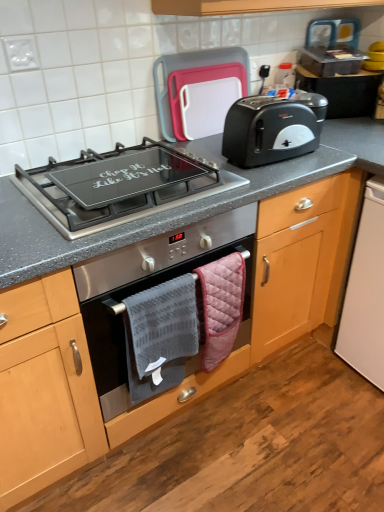
Identify the location of plastic cutting board at upper center. (199, 91).

The height and width of the screenshot is (512, 384). What are the coordinates of `pink quilted hand towel at lower center, the 1th hand towel viewed from the right` in the screenshot? It's located at (220, 306).

This screenshot has height=512, width=384. What do you see at coordinates (220, 306) in the screenshot?
I see `pink quilted hand towel at lower center, the 2th hand towel from the left` at bounding box center [220, 306].

Describe the element at coordinates (119, 186) in the screenshot. I see `black glass cooktop at center` at that location.

What is the approximate height of black glass cooktop at center?

black glass cooktop at center is 1.68 inches tall.

Image resolution: width=384 pixels, height=512 pixels. Identify the location of stainless steel oven at center. (146, 288).

Image resolution: width=384 pixels, height=512 pixels. I want to click on plastic cutting board at upper center, so click(x=199, y=91).

Does metallic silver toaster at upper right, the 1th appliance in the top-to-bottom sequence, come behind gray textured towel at center, which appears as the first hand towel when viewed from the left?

That is True.

Can you confirm if metallic silver toaster at upper right, which ranks as the second appliance in bottom-to-top order, is positioned to the right of gray textured towel at center, which appears as the first hand towel when viewed from the left?

Indeed, metallic silver toaster at upper right, which ranks as the second appliance in bottom-to-top order, is positioned on the right side of gray textured towel at center, which appears as the first hand towel when viewed from the left.

Considering the relative sizes of metallic silver toaster at upper right, the 1th appliance in the top-to-bottom sequence, and gray textured towel at center, which appears as the first hand towel when viewed from the left, in the image provided, is metallic silver toaster at upper right, the 1th appliance in the top-to-bottom sequence, taller than gray textured towel at center, which appears as the first hand towel when viewed from the left,?

No.

From a real-world perspective, is metallic silver toaster at upper right, which ranks as the second appliance in bottom-to-top order, positioned over gray textured towel at center, which appears as the first hand towel when viewed from the left, based on gravity?

Indeed, from a real-world perspective, metallic silver toaster at upper right, which ranks as the second appliance in bottom-to-top order, stands above gray textured towel at center, which appears as the first hand towel when viewed from the left.

From a real-world perspective, is white plastic dishwasher at lower right, marked as the first appliance in a bottom-to-top arrangement, positioned above or below black plastic toaster at upper right?

From a real-world perspective, white plastic dishwasher at lower right, marked as the first appliance in a bottom-to-top arrangement, is physically below black plastic toaster at upper right.

From the picture: Does white plastic dishwasher at lower right, marked as the first appliance in a bottom-to-top arrangement, turn towards black plastic toaster at upper right?

No.

Does white plastic dishwasher at lower right, marked as the first appliance in a bottom-to-top arrangement, touch black plastic toaster at upper right?

They are not placed beside each other.

Measure the distance between white plastic dishwasher at lower right, which is counted as the 2th appliance, starting from the top, and black plastic toaster at upper right.

white plastic dishwasher at lower right, which is counted as the 2th appliance, starting from the top, and black plastic toaster at upper right are 18.99 inches apart.

From a real-world perspective, is black glass cooktop at center positioned over gray textured towel at center, which is the 2th hand towel from right to left, based on gravity?

Correct, in the physical world, black glass cooktop at center is higher than gray textured towel at center, which is the 2th hand towel from right to left.

Which is in front, point (197, 194) or point (185, 307)?

The point (197, 194) is in front.

Is black glass cooktop at center not within gray textured towel at center, which appears as the first hand towel when viewed from the left?

A: Yes, black glass cooktop at center is located beyond the bounds of gray textured towel at center, which appears as the first hand towel when viewed from the left.

From the picture: From the image's perspective, is black glass cooktop at center below gray textured towel at center, which appears as the first hand towel when viewed from the left?

No.

Looking at this image, which is in front, plastic cutting board at upper center or black plastic toaster at upper right?

Positioned in front is black plastic toaster at upper right.

From a real-world perspective, which is physically below, plastic cutting board at upper center or black plastic toaster at upper right?

black plastic toaster at upper right, from a real-world perspective.

Is plastic cutting board at upper center far from black plastic toaster at upper right?

plastic cutting board at upper center is actually quite close to black plastic toaster at upper right.

Is point (194, 117) positioned in front of point (253, 115)?

No, it is not.

Between white plastic dishwasher at lower right, which is counted as the 2th appliance, starting from the top, and plastic cutting board at upper center, which one has smaller size?

With smaller size is plastic cutting board at upper center.

Considering the relative sizes of white plastic dishwasher at lower right, marked as the first appliance in a bottom-to-top arrangement, and plastic cutting board at upper center in the image provided, is white plastic dishwasher at lower right, marked as the first appliance in a bottom-to-top arrangement, taller than plastic cutting board at upper center?

Correct, white plastic dishwasher at lower right, marked as the first appliance in a bottom-to-top arrangement, is much taller as plastic cutting board at upper center.

Is plastic cutting board at upper center located within white plastic dishwasher at lower right, which is counted as the 2th appliance, starting from the top?

No, white plastic dishwasher at lower right, which is counted as the 2th appliance, starting from the top, does not contain plastic cutting board at upper center.

From the image's perspective, which one is positioned higher, white plastic dishwasher at lower right, marked as the first appliance in a bottom-to-top arrangement, or plastic cutting board at upper center?

plastic cutting board at upper center appears higher in the image.

Considering the relative sizes of stainless steel oven at center and plastic cutting board at upper center in the image provided, is stainless steel oven at center wider than plastic cutting board at upper center?

Correct, the width of stainless steel oven at center exceeds that of plastic cutting board at upper center.

Considering the positions of objects stainless steel oven at center and plastic cutting board at upper center in the image provided, who is in front, stainless steel oven at center or plastic cutting board at upper center?

Answer: Positioned in front is stainless steel oven at center.

Based on the photo, is there a large distance between stainless steel oven at center and plastic cutting board at upper center?

stainless steel oven at center is near plastic cutting board at upper center, not far away.

Does point (254, 230) appear closer or farther from the camera than point (190, 77)?

Point (254, 230).

From the image's perspective, which one is positioned higher, stainless steel oven at center or black glass cooktop at center?

black glass cooktop at center.

Which object is closer to the camera, stainless steel oven at center or black glass cooktop at center?

Positioned in front is black glass cooktop at center.

Is stainless steel oven at center far away from black glass cooktop at center?

No, stainless steel oven at center is not far away from black glass cooktop at center.

Based on the photo, do you think stainless steel oven at center is within black glass cooktop at center, or outside of it?

stainless steel oven at center cannot be found inside black glass cooktop at center.

From the metallic silver toaster at upper right, which ranks as the second appliance in bottom-to-top order, count the 2nd hand towel to the left and point to it. Please provide its 2D coordinates.

[(160, 336)]

At what (x,y) coordinates should I click in order to perform the action: click on appliance that is below the black plastic toaster at upper right (from the image's perspective). Please return your answer as a coordinate pair (x, y). The height and width of the screenshot is (512, 384). Looking at the image, I should click on (366, 292).

Considering their positions, is gray textured towel at center, which appears as the first hand towel when viewed from the left, positioned further to metallic silver toaster at upper right, the 1th appliance in the top-to-bottom sequence, than black plastic toaster at upper right?

The object further to metallic silver toaster at upper right, the 1th appliance in the top-to-bottom sequence, is gray textured towel at center, which appears as the first hand towel when viewed from the left.

Considering their positions, is metallic silver toaster at upper right, which ranks as the second appliance in bottom-to-top order, positioned further to stainless steel oven at center than black plastic toaster at upper right?

metallic silver toaster at upper right, which ranks as the second appliance in bottom-to-top order, is further to stainless steel oven at center.

Which object lies nearer to the anchor point black glass cooktop at center, plastic cutting board at upper center or stainless steel oven at center?

stainless steel oven at center is positioned closer to the anchor black glass cooktop at center.

Considering their positions, is metallic silver toaster at upper right, the 1th appliance in the top-to-bottom sequence, positioned further to plastic cutting board at upper center than stainless steel oven at center?

Based on the image, metallic silver toaster at upper right, the 1th appliance in the top-to-bottom sequence, appears to be further to plastic cutting board at upper center.

Looking at the image, which one is located further to stainless steel oven at center, plastic cutting board at upper center or gray textured towel at center, which is the 2th hand towel from right to left?

The object further to stainless steel oven at center is plastic cutting board at upper center.

Which object lies nearer to the anchor point pink quilted hand towel at lower center, the 2th hand towel from the left, stainless steel oven at center or black glass cooktop at center?

stainless steel oven at center.

When comparing their distances from plastic cutting board at upper center, does pink quilted hand towel at lower center, the 2th hand towel from the left, or white plastic dishwasher at lower right, marked as the first appliance in a bottom-to-top arrangement, seem closer?

Among the two, pink quilted hand towel at lower center, the 2th hand towel from the left, is located nearer to plastic cutting board at upper center.

When comparing their distances from black plastic toaster at upper right, does white plastic dishwasher at lower right, which is counted as the 2th appliance, starting from the top, or pink quilted hand towel at lower center, the 2th hand towel from the left, seem further?

white plastic dishwasher at lower right, which is counted as the 2th appliance, starting from the top, is further to black plastic toaster at upper right.

Where is `hand towel between stainless steel oven at center and pink quilted hand towel at lower center, the 1th hand towel viewed from the right`? This screenshot has height=512, width=384. hand towel between stainless steel oven at center and pink quilted hand towel at lower center, the 1th hand towel viewed from the right is located at coordinates (160, 336).

At what (x,y) coordinates should I click in order to perform the action: click on toaster positioned between black glass cooktop at center and plastic cutting board at upper center from near to far. Please return your answer as a coordinate pair (x, y). The width and height of the screenshot is (384, 512). Looking at the image, I should click on (272, 129).

This screenshot has height=512, width=384. In order to click on gas stove between black plastic toaster at upper right and gray textured towel at center, which appears as the first hand towel when viewed from the left, in the up-down direction in this screenshot , I will do `click(119, 186)`.

Locate an element on the screen. This screenshot has height=512, width=384. toaster situated between plastic cutting board at upper center and white plastic dishwasher at lower right, marked as the first appliance in a bottom-to-top arrangement, from left to right is located at coordinates [272, 129].